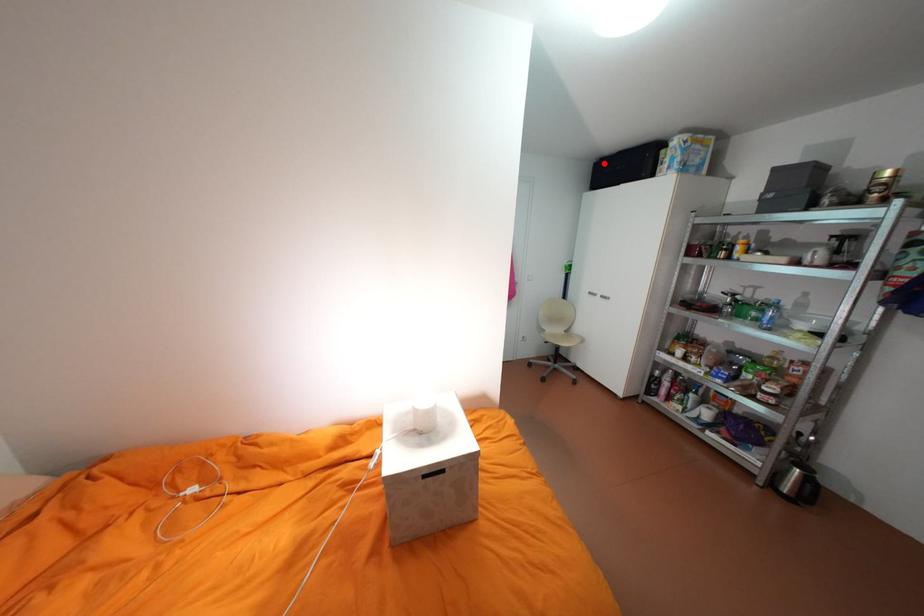
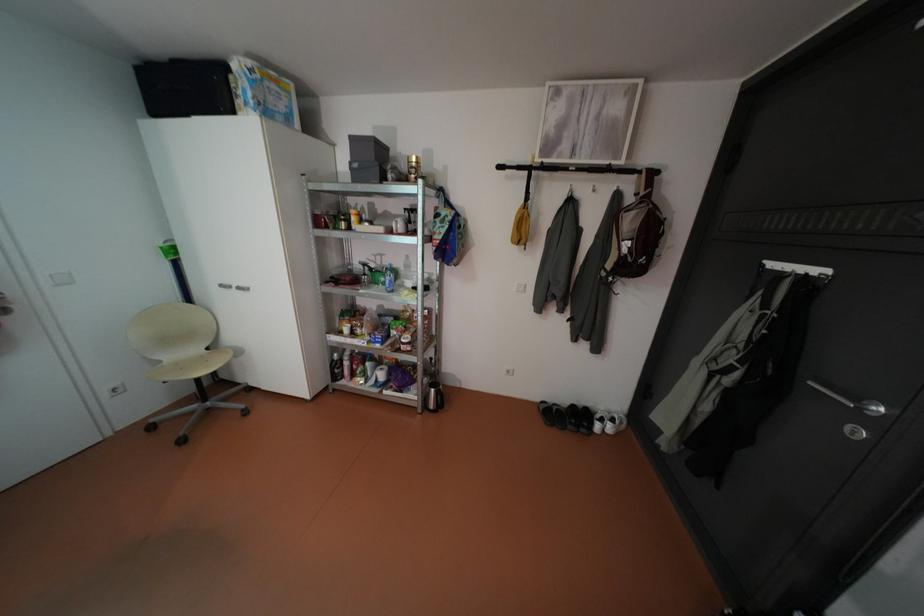
Where in the second image is the point corresponding to the highlighted location from the first image?

(147, 69)